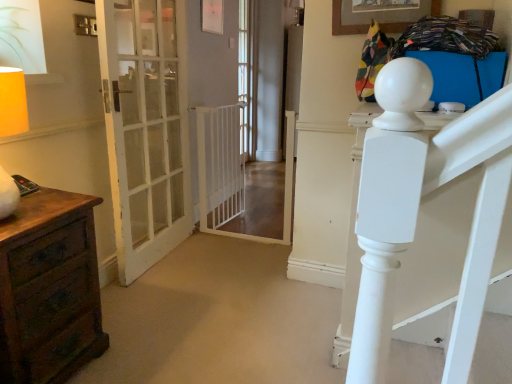
Question: Considering the relative sizes of white plastic gate at center and brown wood chest of drawers at left in the image provided, is white plastic gate at center wider than brown wood chest of drawers at left?

Choices:
 (A) no
 (B) yes

Answer: (A)

Question: Is white plastic gate at center behind brown wood chest of drawers at left?

Choices:
 (A) yes
 (B) no

Answer: (A)

Question: Is white plastic gate at center oriented away from brown wood chest of drawers at left?

Choices:
 (A) no
 (B) yes

Answer: (A)

Question: Does white plastic gate at center have a smaller size compared to brown wood chest of drawers at left?

Choices:
 (A) yes
 (B) no

Answer: (A)

Question: From the image's perspective, is white plastic gate at center under brown wood chest of drawers at left?

Choices:
 (A) yes
 (B) no

Answer: (B)

Question: Considering the positions of point (254, 91) and point (98, 326), is point (254, 91) closer or farther from the camera than point (98, 326)?

Choices:
 (A) closer
 (B) farther

Answer: (B)

Question: Relative to brown wood chest of drawers at left, is clear glass door at center in front or behind?

Choices:
 (A) front
 (B) behind

Answer: (B)

Question: From their relative heights in the image, would you say clear glass door at center is taller or shorter than brown wood chest of drawers at left?

Choices:
 (A) tall
 (B) short

Answer: (A)

Question: Looking at their shapes, would you say clear glass door at center is wider or thinner than brown wood chest of drawers at left?

Choices:
 (A) wide
 (B) thin

Answer: (B)

Question: Is brown wood chest of drawers at left in front of or behind white glass door at left in the image?

Choices:
 (A) behind
 (B) front

Answer: (B)

Question: In terms of height, does brown wood chest of drawers at left look taller or shorter compared to white glass door at left?

Choices:
 (A) short
 (B) tall

Answer: (A)

Question: From a real-world perspective, is brown wood chest of drawers at left positioned above or below white glass door at left?

Choices:
 (A) above
 (B) below

Answer: (B)

Question: From the image's perspective, is brown wood chest of drawers at left above or below white glass door at left?

Choices:
 (A) below
 (B) above

Answer: (A)

Question: From the image's perspective, is brown wood chest of drawers at left positioned above or below white plastic gate at center?

Choices:
 (A) above
 (B) below

Answer: (B)

Question: From a real-world perspective, is brown wood chest of drawers at left physically located above or below white plastic gate at center?

Choices:
 (A) above
 (B) below

Answer: (B)